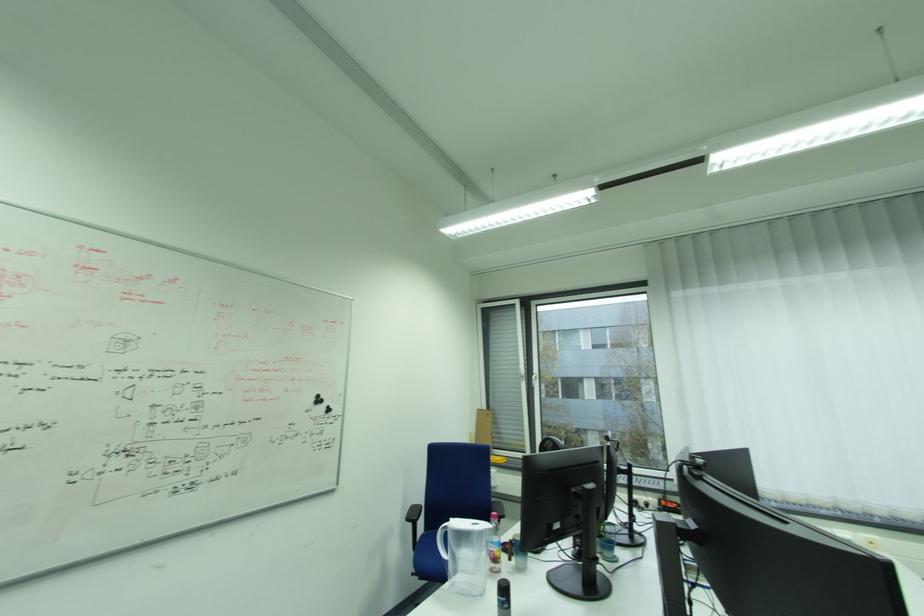
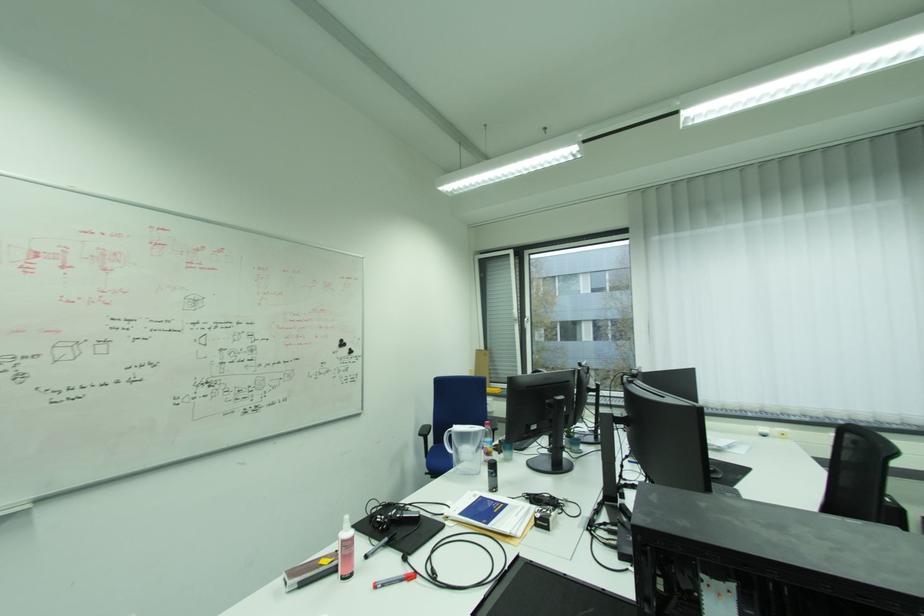
Question: Based on the continuous images, in which direction is the camera rotating? Reply with the corresponding letter.

Choices:
 (A) Left
 (B) Right
 (C) Up
 (D) Down

Answer: (D)